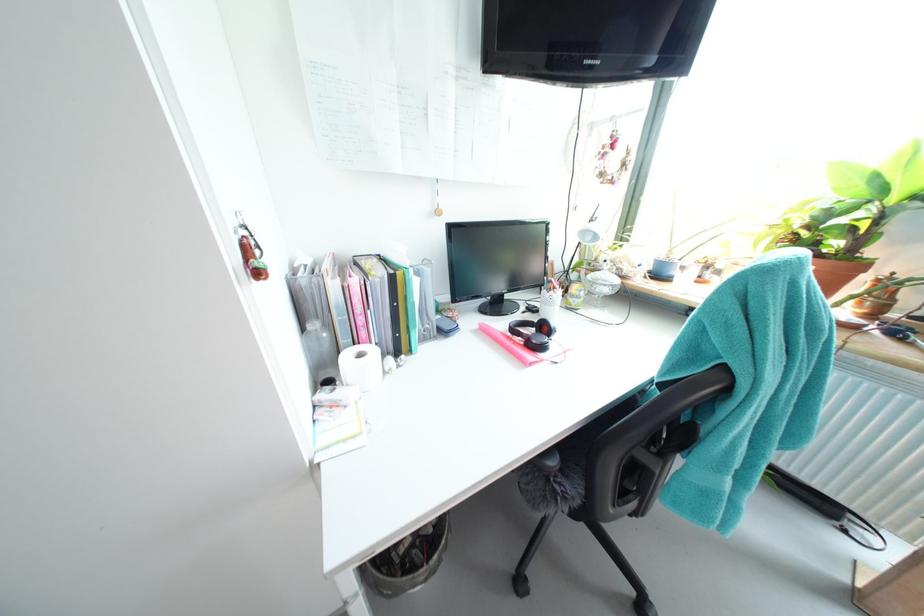
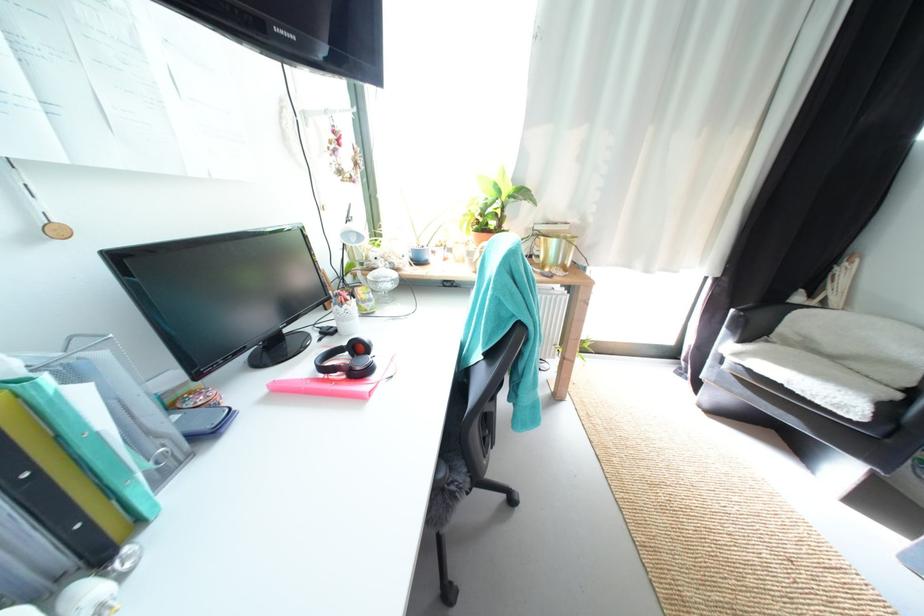
The point at (542,342) is marked in the first image. Where is the corresponding point in the second image?

(367, 370)